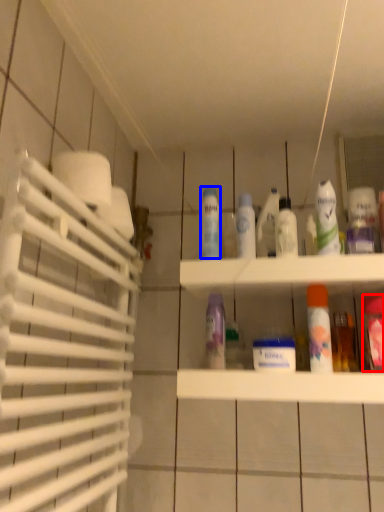
Question: Which of the following is the farthest to the observer, mouthwash (highlighted by a red box) or cleaning product (highlighted by a blue box)?

Choices:
 (A) mouthwash
 (B) cleaning product

Answer: (B)